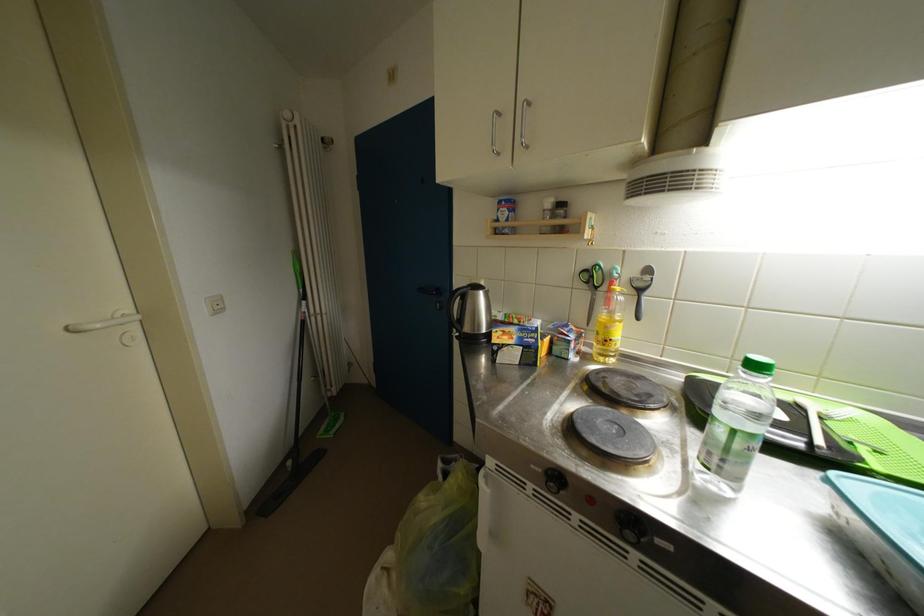
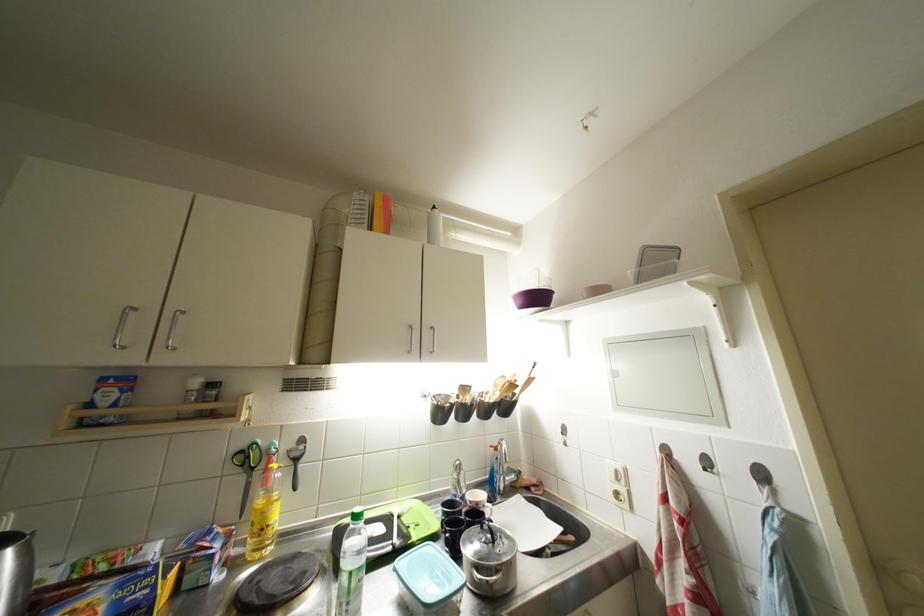
Where in the second image is the point corresponding to the point at 744,450 from the first image?

(359, 589)